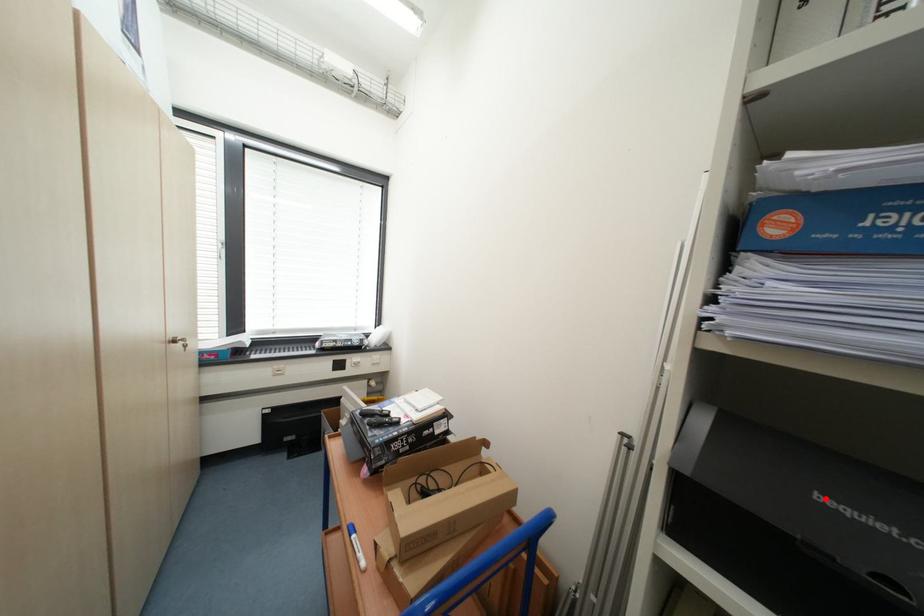
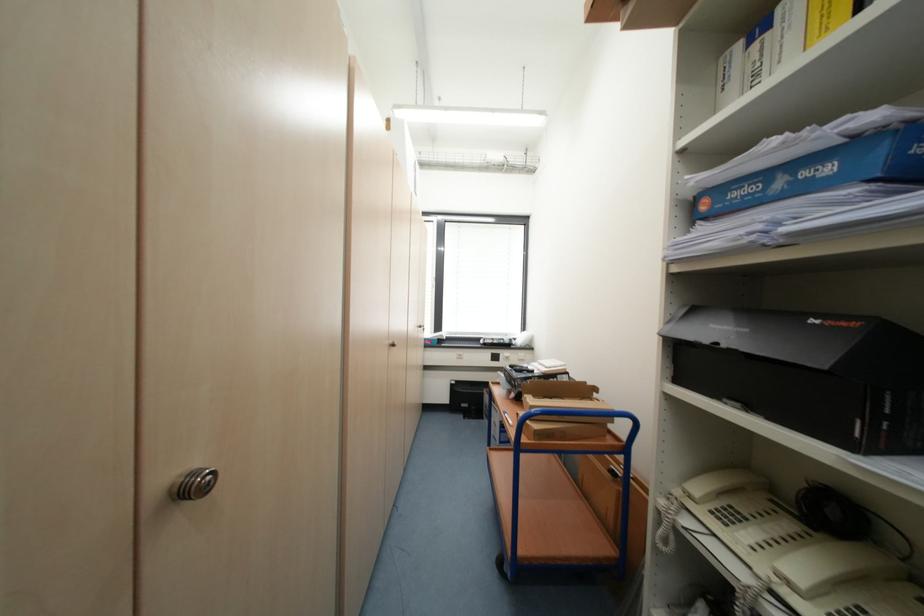
Where in the second image is the point corresponding to the highlighted location from the first image?

(718, 326)